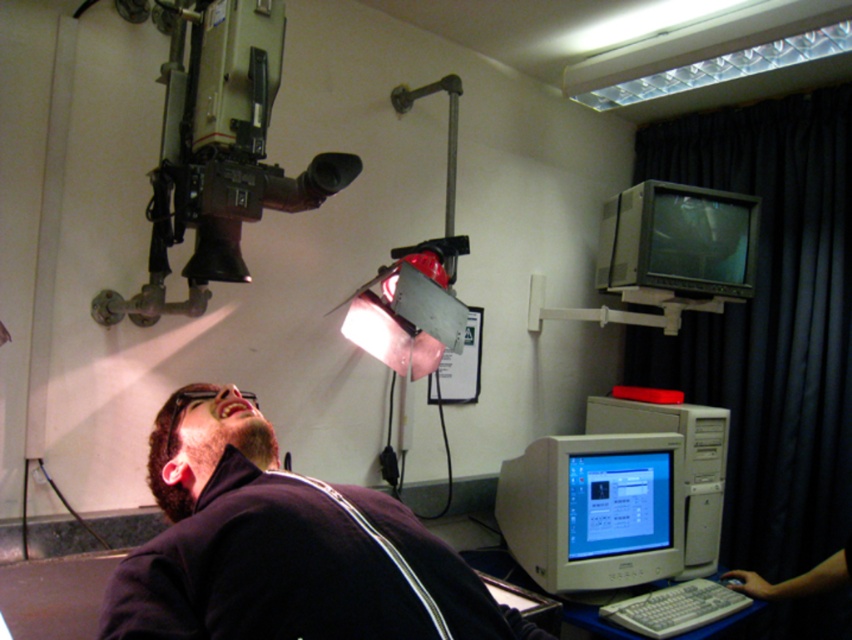
You are a technician in this medical imaging room. You need to adjust the settings on both the matte gray monitor at upper right and the white plastic computer at lower right. Which device do you need to reach down more to access?

The matte gray monitor at upper right has a lesser height compared to the white plastic computer at lower right, so you need to reach down more to access the matte gray monitor at upper right.

You are a technician in a medical facility. You need to adjust both the matte gray monitor at upper right and the matte gray monitor at center. Which monitor should you adjust first if you want to start with the one closer to you?

You should adjust the matte gray monitor at upper right first because it is closer to you than the matte gray monitor at center.